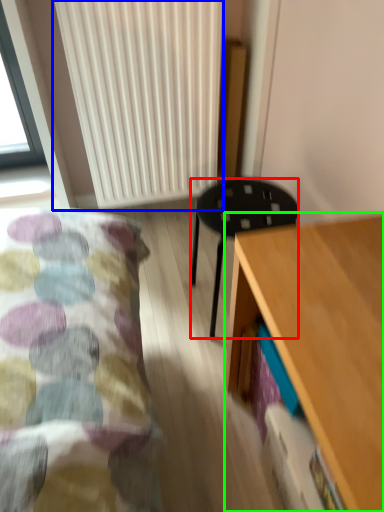
Question: Considering the real-world distances, which object is farthest from stool (highlighted by a red box)? radiator (highlighted by a blue box) or desk (highlighted by a green box)?

Choices:
 (A) radiator
 (B) desk

Answer: (A)